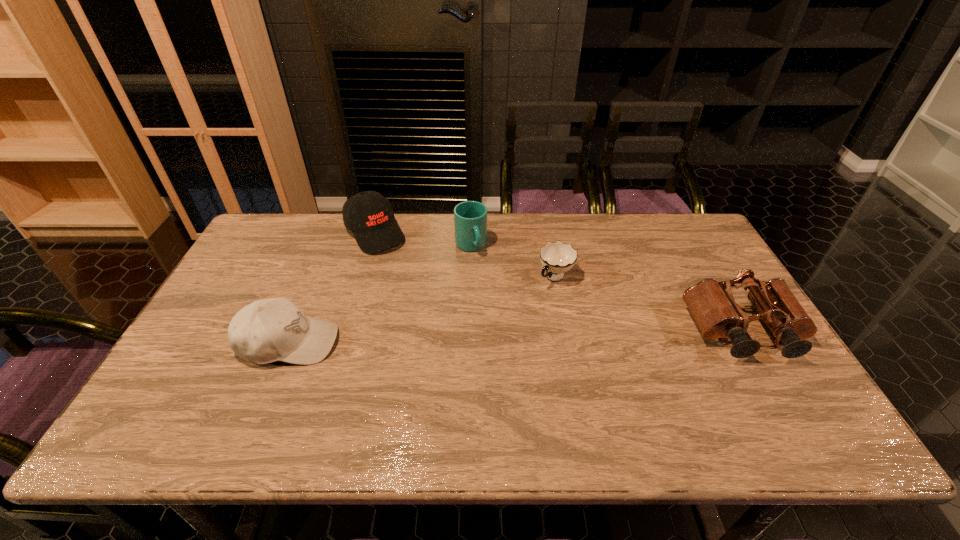
The height and width of the screenshot is (540, 960). What are the coordinates of `unoccupied position between the rightmost object and the farther baseball cap` in the screenshot? It's located at (559, 282).

Locate an element on the screen. This screenshot has width=960, height=540. unoccupied area between the left cup and the farther baseball cap is located at coordinates (423, 239).

Where is `vacant area that lies between the nearer baseball cap and the binoculars`? The image size is (960, 540). vacant area that lies between the nearer baseball cap and the binoculars is located at coordinates (516, 337).

The image size is (960, 540). In order to click on vacant space that's between the binoculars and the farther baseball cap in this screenshot , I will do `click(559, 282)`.

I want to click on free space between the nearer cup and the nearer baseball cap, so click(422, 310).

The height and width of the screenshot is (540, 960). I want to click on the third closest object to the farther baseball cap, so click(557, 258).

Find the location of `the closest object to the third object from right to left`. the closest object to the third object from right to left is located at coordinates (557, 258).

This screenshot has height=540, width=960. Find the location of `blank area in the image that satisfies the following two spatial constraints: 1. on the front side of the third farthest object; 2. on the left side of the left cup`. blank area in the image that satisfies the following two spatial constraints: 1. on the front side of the third farthest object; 2. on the left side of the left cup is located at coordinates click(470, 277).